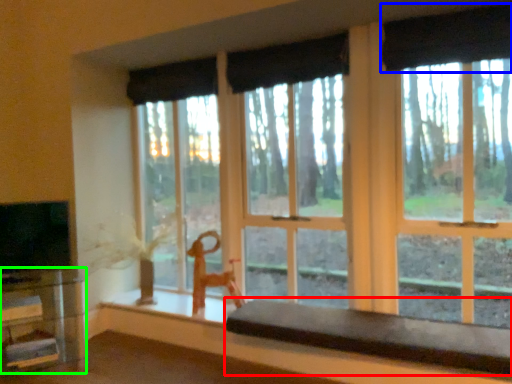
Question: Estimate the real-world distances between objects in this image. Which object is closer to table (highlighted by a red box), curtain (highlighted by a blue box) or table (highlighted by a green box)?

Choices:
 (A) curtain
 (B) table

Answer: (B)